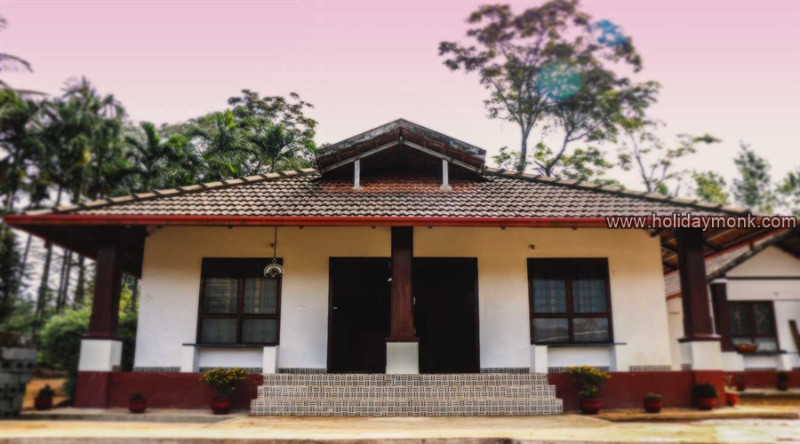
The image size is (800, 444). In order to click on pillars in this screenshot , I will do `click(400, 312)`, `click(705, 317)`, `click(720, 320)`, `click(102, 306)`.